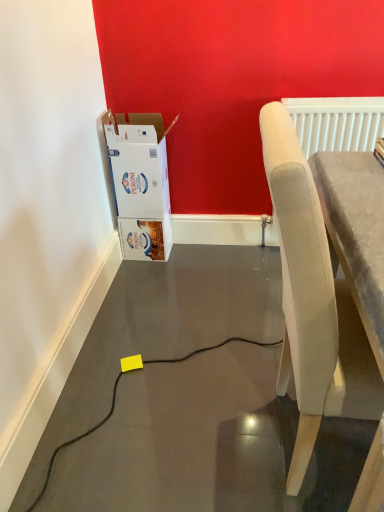
Question: Is white cardboard box at left not inside light gray fabric chair at right?

Choices:
 (A) no
 (B) yes

Answer: (B)

Question: Is white cardboard box at left wider than light gray fabric chair at right?

Choices:
 (A) no
 (B) yes

Answer: (A)

Question: Considering the relative sizes of white cardboard box at left and light gray fabric chair at right in the image provided, is white cardboard box at left taller than light gray fabric chair at right?

Choices:
 (A) no
 (B) yes

Answer: (A)

Question: Does white cardboard box at left lie in front of light gray fabric chair at right?

Choices:
 (A) no
 (B) yes

Answer: (A)

Question: Is white cardboard box at left to the left of light gray fabric chair at right from the viewer's perspective?

Choices:
 (A) yes
 (B) no

Answer: (A)

Question: Is white cardboard box at left oriented away from light gray fabric chair at right?

Choices:
 (A) yes
 (B) no

Answer: (B)

Question: Is white textured radiator at upper right oriented towards white cardboard box at left?

Choices:
 (A) no
 (B) yes

Answer: (A)

Question: Is the surface of white textured radiator at upper right in direct contact with white cardboard box at left?

Choices:
 (A) no
 (B) yes

Answer: (A)

Question: Can you confirm if white textured radiator at upper right is wider than white cardboard box at left?

Choices:
 (A) yes
 (B) no

Answer: (B)

Question: From the image's perspective, does white textured radiator at upper right appear higher than white cardboard box at left?

Choices:
 (A) no
 (B) yes

Answer: (B)

Question: Considering the relative sizes of white textured radiator at upper right and white cardboard box at left in the image provided, is white textured radiator at upper right smaller than white cardboard box at left?

Choices:
 (A) no
 (B) yes

Answer: (B)

Question: Does white textured radiator at upper right have a lesser width compared to white cardboard box at left?

Choices:
 (A) yes
 (B) no

Answer: (A)

Question: Is light gray fabric chair at right positioned before white cardboard box at left?

Choices:
 (A) no
 (B) yes

Answer: (B)